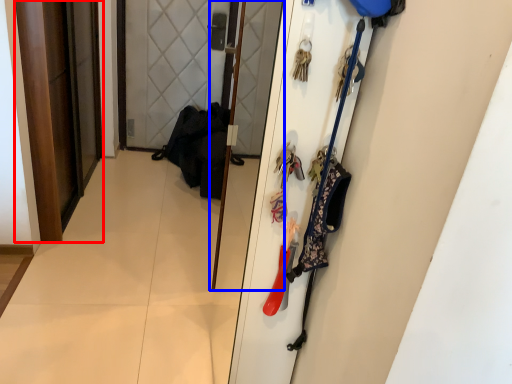
Question: Which object appears closest to the camera in this image, door (highlighted by a red box) or screen door (highlighted by a blue box)?

Choices:
 (A) door
 (B) screen door

Answer: (B)